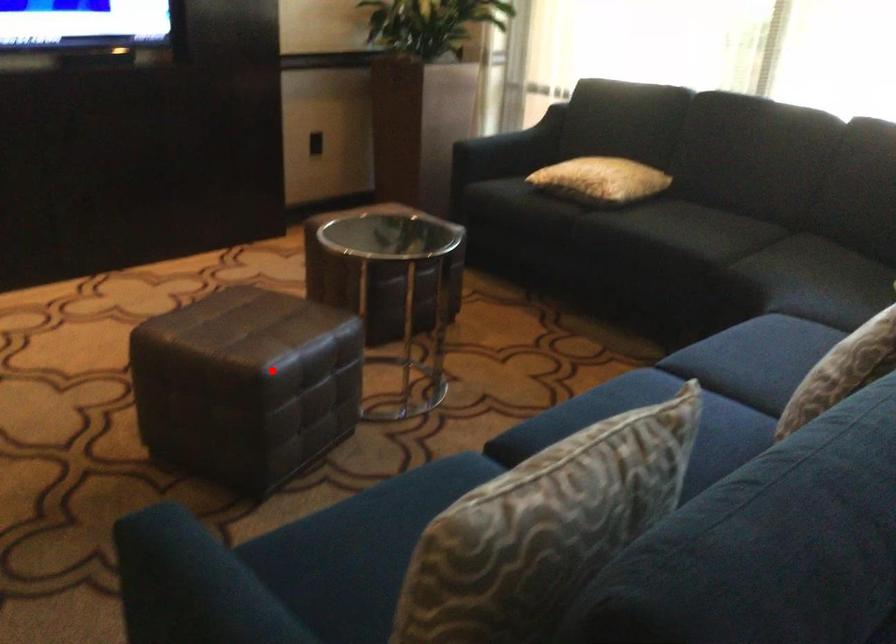
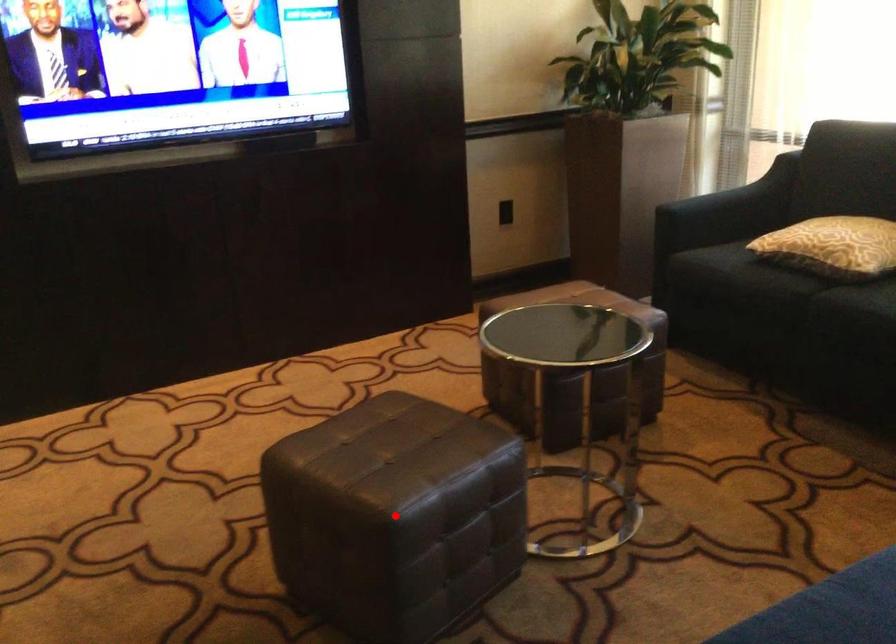
I am providing you with two images of the same scene from different viewpoints. A red point is marked on the first image and another point is marked on the second image. Do the highlighted points in image1 and image2 indicate the same real-world spot?

Yes